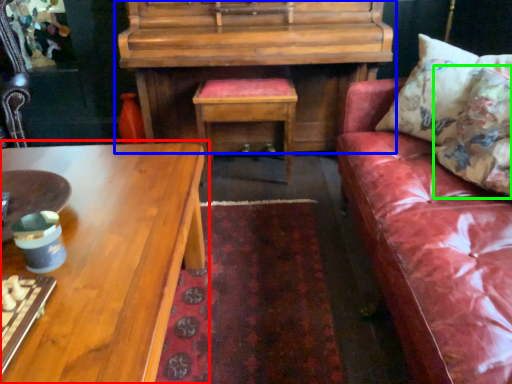
Question: Which object is positioned closest to coffee table (highlighted by a red box)? Select from piano (highlighted by a blue box) and pillow (highlighted by a green box).

Choices:
 (A) piano
 (B) pillow

Answer: (A)